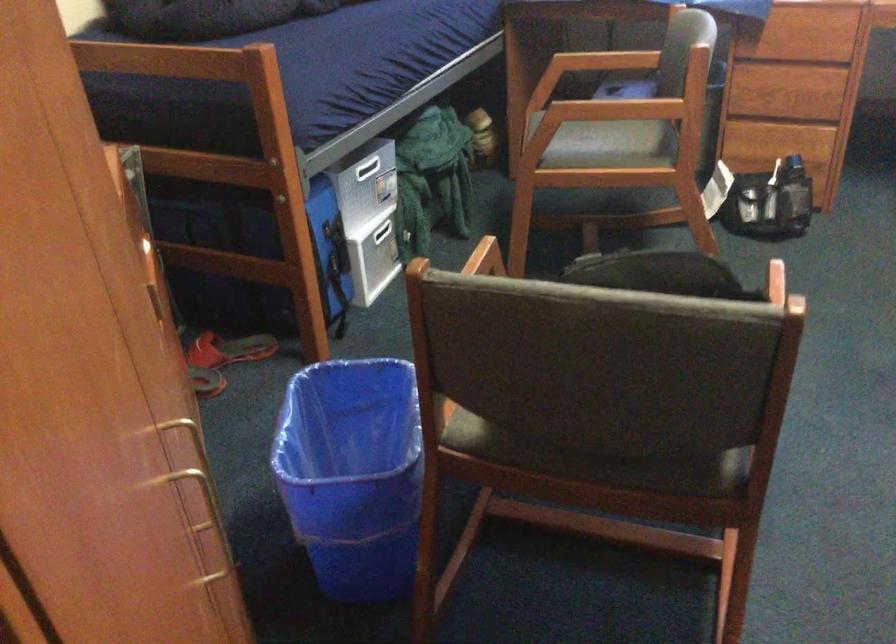
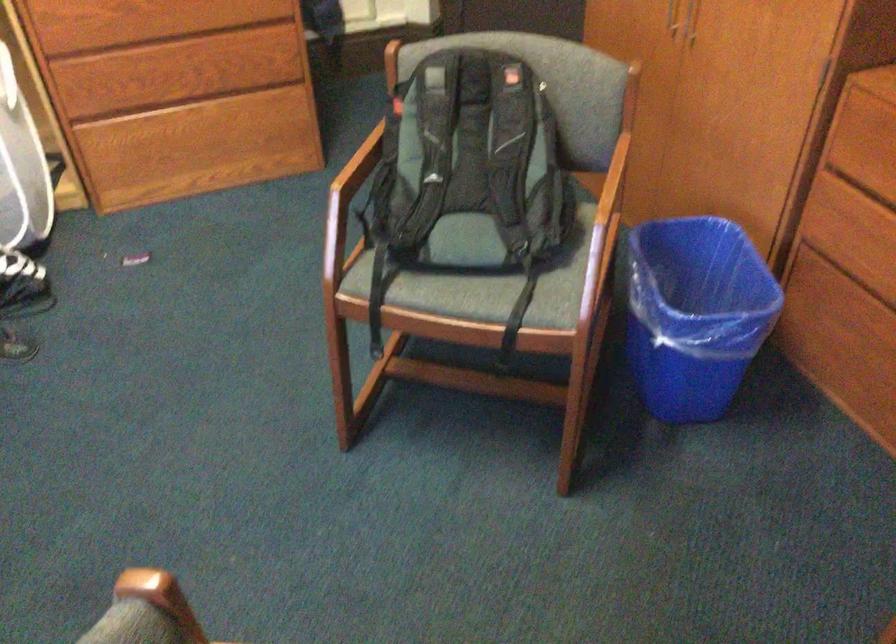
Where in the second image is the point corresponding to the point at 612,263 from the first image?

(470, 62)